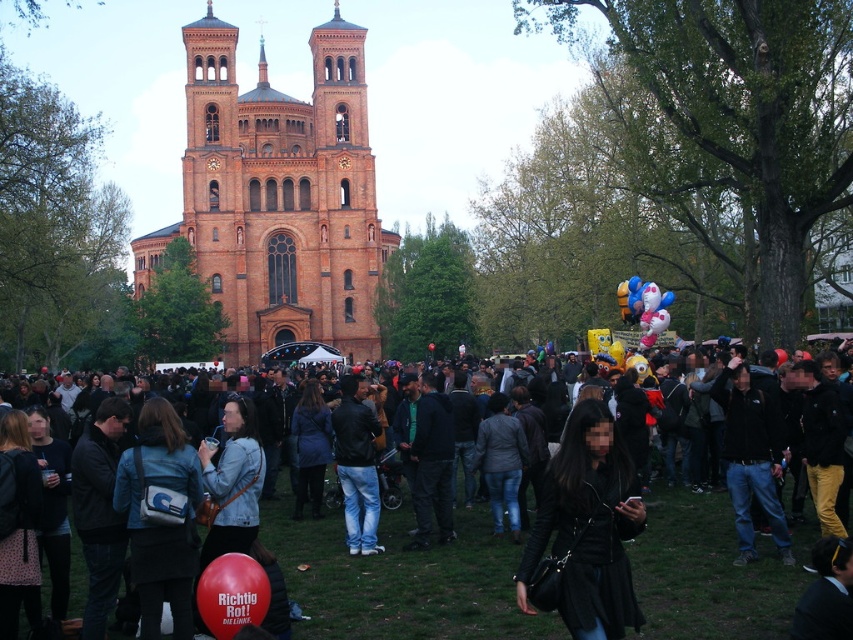
Between black leather jacket at center and multicolored balloons at center, which one has less height?

With less height is multicolored balloons at center.

Measure the distance from black leather jacket at center to multicolored balloons at center.

29.53 meters

Which is in front, point (587, 557) or point (639, 278)?

Point (587, 557) is more forward.

In order to click on black leather jacket at center in this screenshot , I will do `click(587, 528)`.

Is brown brick church at upper left above rubber balloon at center?

Yes.

Who is more distant from viewer, [350,193] or [212,616]?

Positioned behind is point [350,193].

Find the location of a particular element. brown brick church at upper left is located at coordinates (277, 196).

Does matte blue jacket at center appear on the right side of rubber balloon at center?

Incorrect, matte blue jacket at center is not on the right side of rubber balloon at center.

Who is taller, matte blue jacket at center or rubber balloon at center?

matte blue jacket at center

Describe the element at coordinates (158, 524) in the screenshot. I see `matte blue jacket at center` at that location.

At what (x,y) coordinates should I click in order to perform the action: click on matte blue jacket at center. Please return your answer as a coordinate pair (x, y). This screenshot has height=640, width=853. Looking at the image, I should click on (158, 524).